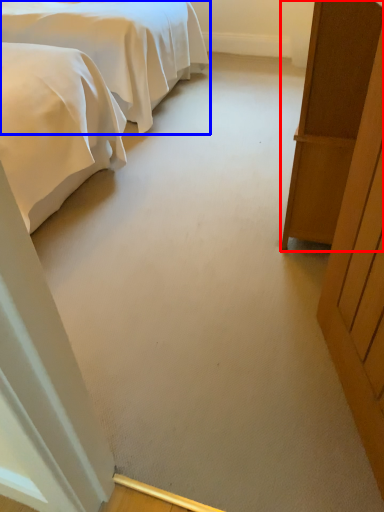
Question: Which object is further to the camera taking this photo, furniture (highlighted by a red box) or bed (highlighted by a blue box)?

Choices:
 (A) furniture
 (B) bed

Answer: (B)